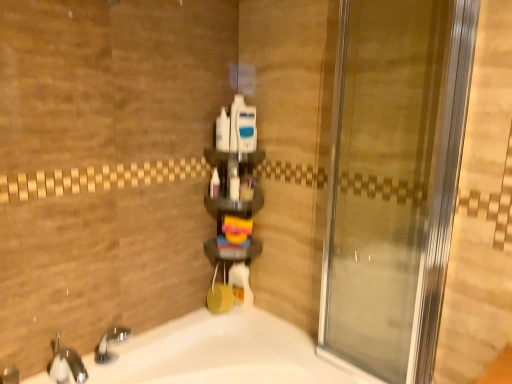
Question: Could you tell me if white glossy bottle at center, which is counted as the 3th toiletry, starting from the right, is facing white plastic container at center, the 4th toiletry when ordered from left to right?

Choices:
 (A) yes
 (B) no

Answer: (B)

Question: Is white glossy bottle at center, positioned as the third toiletry in left-to-right order, turned away from white plastic container at center, the 4th toiletry when ordered from left to right?

Choices:
 (A) no
 (B) yes

Answer: (A)

Question: Can you confirm if white glossy bottle at center, positioned as the third toiletry in left-to-right order, is thinner than white plastic container at center, the 4th toiletry when ordered from left to right?

Choices:
 (A) no
 (B) yes

Answer: (B)

Question: Is white glossy bottle at center, positioned as the third toiletry in left-to-right order, to the left of white plastic container at center, the 4th toiletry when ordered from left to right, from the viewer's perspective?

Choices:
 (A) yes
 (B) no

Answer: (A)

Question: Is white glossy bottle at center, positioned as the third toiletry in left-to-right order, positioned far away from white plastic container at center, the 2th toiletry positioned from the right?

Choices:
 (A) yes
 (B) no

Answer: (B)

Question: In terms of width, does white plastic container at center, the 2th toiletry positioned from the right, look wider or thinner when compared to translucent plastic bottle at center, arranged as the fifth toiletry when viewed from the right?

Choices:
 (A) thin
 (B) wide

Answer: (B)

Question: Visually, is white plastic container at center, the 2th toiletry positioned from the right, positioned to the left or to the right of translucent plastic bottle at center, arranged as the fifth toiletry when viewed from the right?

Choices:
 (A) left
 (B) right

Answer: (B)

Question: Is white plastic container at center, the 4th toiletry when ordered from left to right, inside or outside of translucent plastic bottle at center, which is the 1th toiletry from left to right?

Choices:
 (A) outside
 (B) inside

Answer: (A)

Question: Is white plastic container at center, the 4th toiletry when ordered from left to right, bigger or smaller than translucent plastic bottle at center, arranged as the fifth toiletry when viewed from the right?

Choices:
 (A) big
 (B) small

Answer: (A)

Question: From the image's perspective, is translucent plastic bottle at center, arranged as the fifth toiletry when viewed from the right, above or below blue plastic razor at center, the fifth toiletry from the left?

Choices:
 (A) below
 (B) above

Answer: (A)

Question: Considering the positions of translucent plastic bottle at center, arranged as the fifth toiletry when viewed from the right, and blue plastic razor at center, which is the first toiletry from right to left, in the image, is translucent plastic bottle at center, arranged as the fifth toiletry when viewed from the right, wider or thinner than blue plastic razor at center, which is the first toiletry from right to left,?

Choices:
 (A) wide
 (B) thin

Answer: (B)

Question: Is point click(216, 193) closer or farther from the camera than point click(253, 145)?

Choices:
 (A) closer
 (B) farther

Answer: (B)

Question: Would you say translucent plastic bottle at center, arranged as the fifth toiletry when viewed from the right, is to the left or to the right of blue plastic razor at center, which is the first toiletry from right to left, in the picture?

Choices:
 (A) left
 (B) right

Answer: (A)

Question: In terms of width, does translucent plastic bottle at center, which is the 1th toiletry from left to right, look wider or thinner when compared to brushed metal faucet at lower left?

Choices:
 (A) thin
 (B) wide

Answer: (A)

Question: From the image's perspective, is translucent plastic bottle at center, arranged as the fifth toiletry when viewed from the right, positioned above or below brushed metal faucet at lower left?

Choices:
 (A) below
 (B) above

Answer: (B)